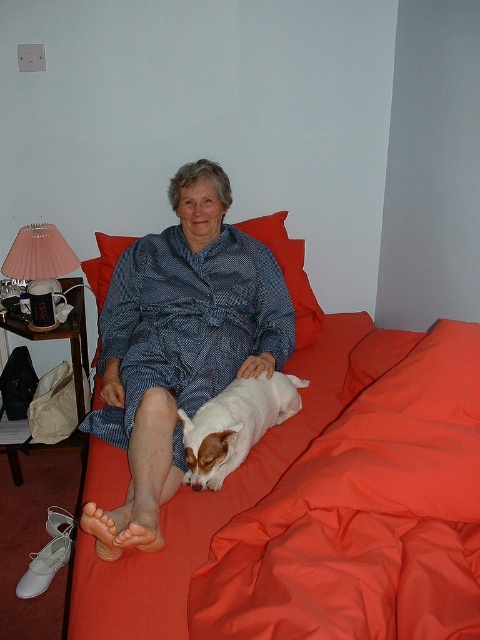
Question: Based on their relative distances, which object is nearer to the matte orange bed at center?

Choices:
 (A) red soft pillow at upper center
 (B) blue printed fabric at center
 (C) white fur dog at center

Answer: (C)

Question: Can you confirm if white fur dog at center is smaller than red soft pillow at upper center?

Choices:
 (A) yes
 (B) no

Answer: (B)

Question: Is matte orange bed at center thinner than white fur dog at center?

Choices:
 (A) no
 (B) yes

Answer: (A)

Question: Considering the relative positions of blue printed fabric at center and red soft pillow at upper center in the image provided, where is blue printed fabric at center located with respect to red soft pillow at upper center?

Choices:
 (A) right
 (B) left

Answer: (B)

Question: Which point is closer to the camera taking this photo?

Choices:
 (A) (265, 240)
 (B) (280, 376)
 (C) (248, 333)

Answer: (B)

Question: Which of these objects is positioned farthest from the blue printed fabric at center?

Choices:
 (A) white fur dog at center
 (B) matte orange bed at center

Answer: (B)